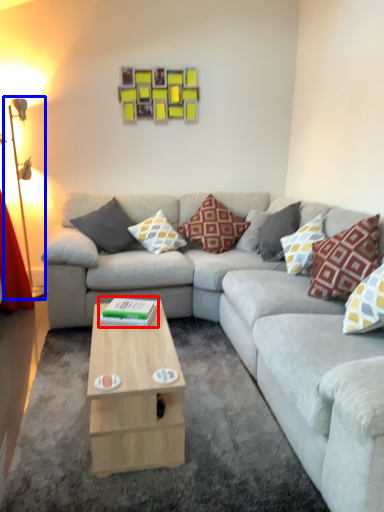
Question: Which point is closer to the camera, book (highlighted by a red box) or table lamp (highlighted by a blue box)?

Choices:
 (A) book
 (B) table lamp

Answer: (A)